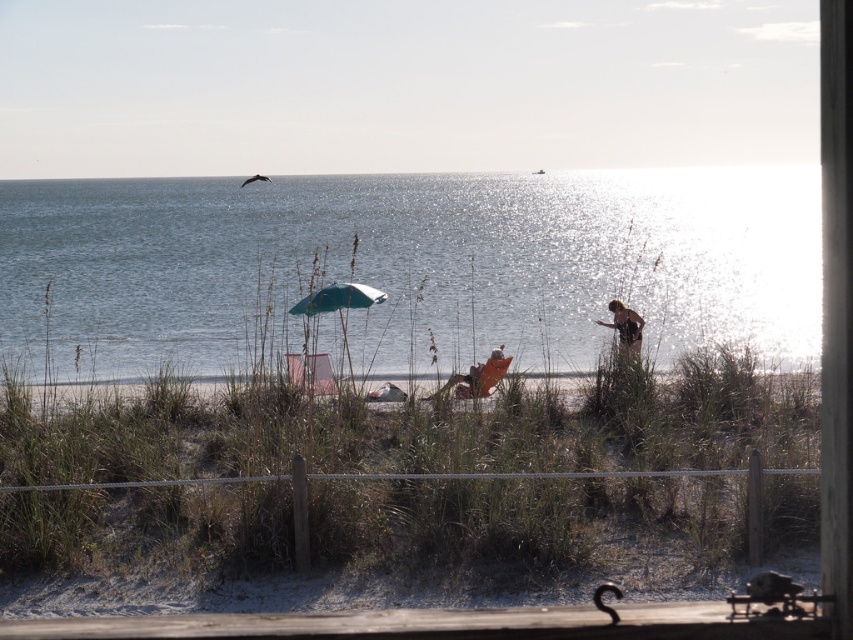
You are planning to set up a small picnic on the beach. You have a brown textured shirt at right and a teal fabric umbrella at center. Which item can provide more shade coverage for your picnic setup?

The teal fabric umbrella at center might be wider than brown textured shirt at right, so it can provide more shade coverage for your picnic setup.

You are a photographer setting up equipment on the beach. You have a teal fabric umbrella at center and a brown textured shirt at right in your shot. Which object will block the view of the other if you move your camera slightly to the left?

The teal fabric umbrella at center is in front of the brown textured shirt at right, so moving the camera to the left might cause the umbrella to block the view of the shirt.